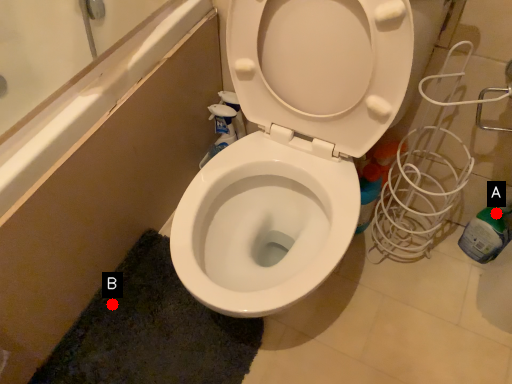
Question: Two points are circled on the image, labeled by A and B beside each circle. Which point is closer to the camera?

Choices:
 (A) A is closer
 (B) B is closer

Answer: (A)